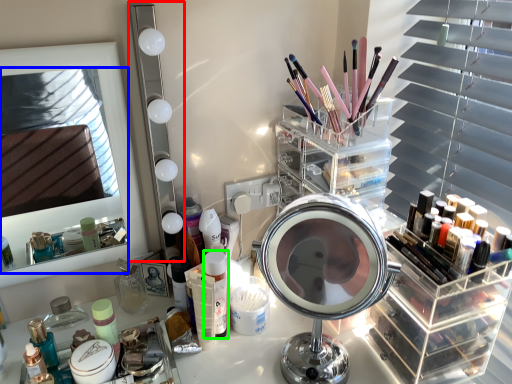
Question: Which object is positioned closest to mirror (highlighted by a red box)? Select from mirror (highlighted by a blue box) and toiletry (highlighted by a green box).

Choices:
 (A) mirror
 (B) toiletry

Answer: (B)